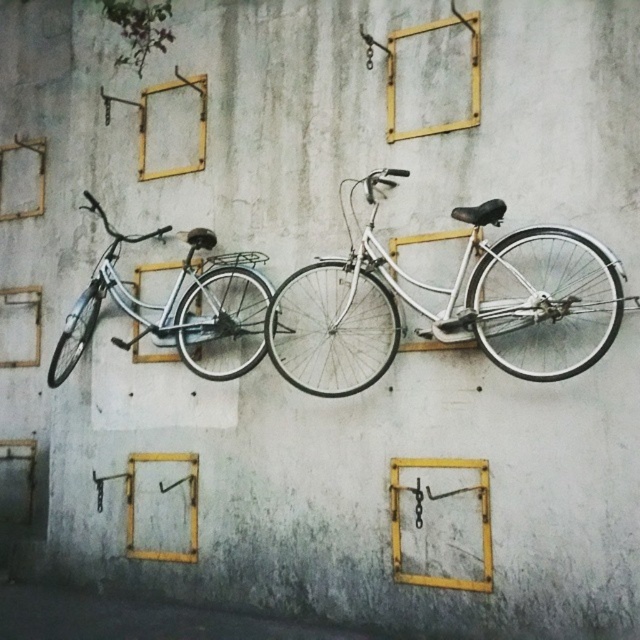
You are an art installer who needs to ensure the stability of the bicycles. Given that the white metallic bicycle at center is above the matte white bicycle at left, which bicycle is more likely to cast a shadow on the other? Explain your reasoning based on their positions.

The white metallic bicycle at center is above the matte white bicycle at left, so if the light source is coming from below, the white metallic bicycle at center would cast a shadow downward onto the matte white bicycle at left. However, if the light is above, the matte white bicycle at left might cast a shadow upward, which is less likely. Typically, light sources are above, so the shadow would depend on the light direction, but based on their vertical positions alone, the upper bicycle could block light to

You are an art installer setting up an exhibition. You have two bicycles to hang on a wall. The white metallic bicycle at center is larger than the matte white bicycle at left. You need to ensure that the yellow metal brackets used for each bicycle are proportional to the size of the bicycles. Which bicycle requires a larger bracket?

The white metallic bicycle at center requires a larger bracket because it is bigger than the matte white bicycle at left.